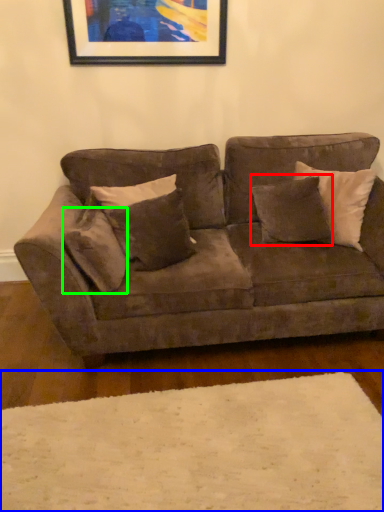
Question: Considering the real-world distances, which object is closest to pillow (highlighted by a red box)? plain (highlighted by a blue box) or pillow (highlighted by a green box).

Choices:
 (A) plain
 (B) pillow

Answer: (B)